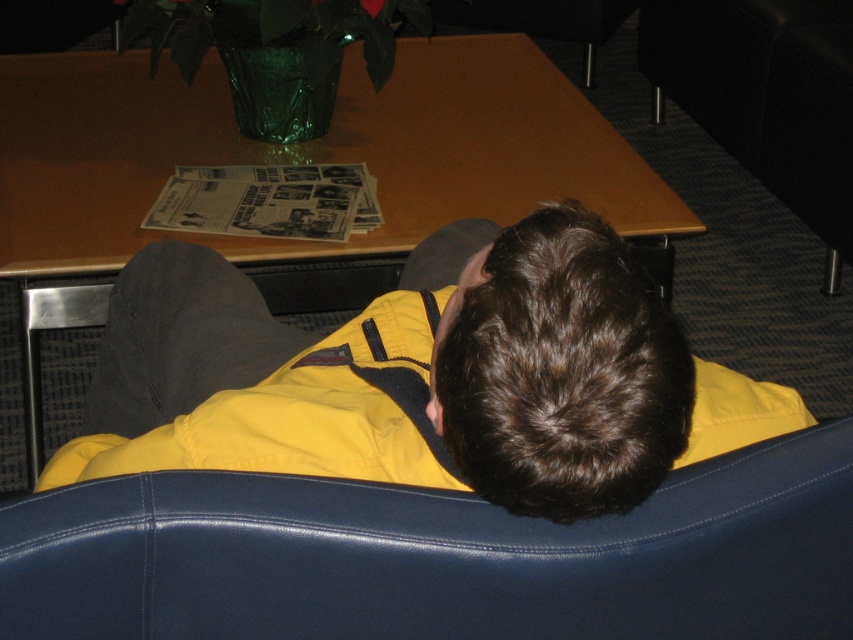
You are standing in the living room and want to place a tray on the wooden table at center. However, you need to walk around the black leather couch at lower right to reach it. Based on their positions, which direction should you move relative to the couch to get to the table?

The wooden table at center is to the left of the black leather couch at lower right, so you should move to the left side of the couch to reach the table.

You are a delivery robot that is 1.2 meters tall. You need to place a package on the wooden table at center. Can you reach the table without climbing anything?

The wooden table at center is 1.51 meters away from the camera, but the question is about height. Since the robot is 1.2 meters tall and the table height isn